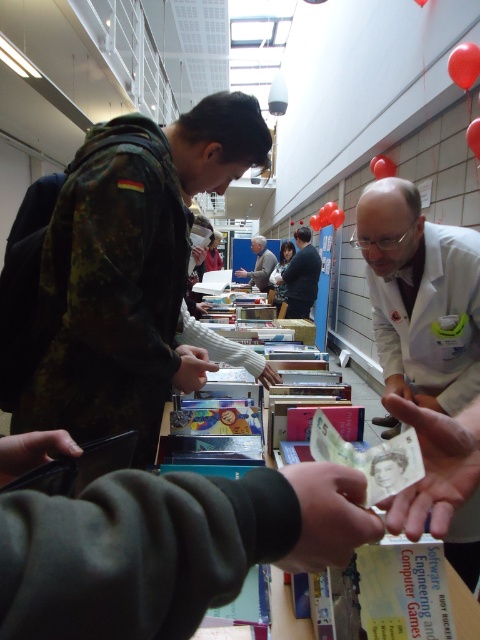
You are a customer in the bookstore and you see the white lab coat at center and the light brown leather jacket at center. Which one is positioned lower in the scene?

The white lab coat at center is located below the light brown leather jacket at center, so the white lab coat at center is positioned lower in the scene.